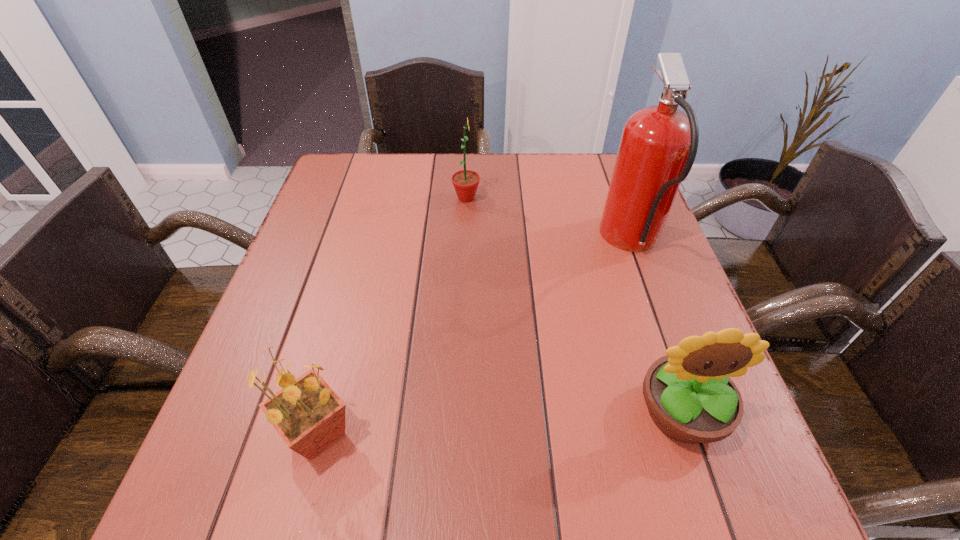
Where is `empty space between the farthest object and the leftmost object`? This screenshot has width=960, height=540. empty space between the farthest object and the leftmost object is located at coordinates (393, 316).

Identify the location of empty space that is in between the leftmost object and the rightmost sunflower. This screenshot has height=540, width=960. (499, 422).

Where is `object that is the closest to the leftmost object`? Image resolution: width=960 pixels, height=540 pixels. object that is the closest to the leftmost object is located at coordinates (690, 397).

Identify which object is located as the third nearest to the farthest sunflower. Please provide its 2D coordinates. Your answer should be formatted as a tuple, i.e. [(x, y)], where the tuple contains the x and y coordinates of a point satisfying the conditions above.

[(690, 397)]

In order to click on the closest sunflower to the rightmost sunflower in this screenshot , I will do `click(308, 415)`.

You are a GUI agent. You are given a task and a screenshot of the screen. Output one action in this format:
    pyautogui.click(x=<x>, y=<y>)
    Task: Click on the sunflower object that ranks as the closest to the rightmost sunflower
    
    Given the screenshot: What is the action you would take?
    pyautogui.click(x=308, y=415)

Identify the location of blank space that satisfies the following two spatial constraints: 1. with the handle and nozzle on the fire extinguisher; 2. on the face of the rightmost sunflower. This screenshot has height=540, width=960. [x=694, y=411].

Identify the location of vacant space that satisfies the following two spatial constraints: 1. with the handle and nozzle on the tallest object; 2. on the face of the rightmost sunflower. The width and height of the screenshot is (960, 540). (694, 411).

The image size is (960, 540). Identify the location of free spot that satisfies the following two spatial constraints: 1. on the face of the second sunflower from right to left; 2. at the front of the leftmost object with flowers visible. (458, 434).

The height and width of the screenshot is (540, 960). I want to click on vacant region that satisfies the following two spatial constraints: 1. with the handle and nozzle on the tallest object; 2. at the front of the leftmost sunflower with flowers visible, so click(702, 434).